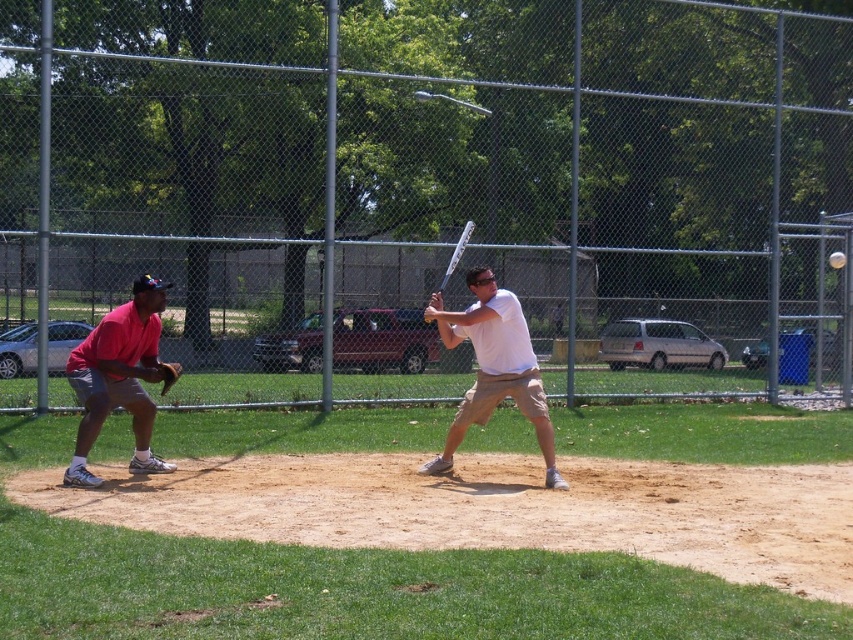
Question: Which is farther from the silver metallic bat at center?

Choices:
 (A) matte pink shirt at left
 (B) brown leather glove at left
 (C) white matte baseball bat at center
 (D) white matte baseball at center

Answer: (D)

Question: Is white matte baseball bat at center to the right of white matte baseball at center from the viewer's perspective?

Choices:
 (A) yes
 (B) no

Answer: (B)

Question: From the image, what is the correct spatial relationship of brown leather glove at left in relation to white matte baseball at center?

Choices:
 (A) below
 (B) above

Answer: (A)

Question: Is silver metallic bat at center smaller than brown leather glove at left?

Choices:
 (A) no
 (B) yes

Answer: (A)

Question: Considering the real-world distances, which object is closest to the silver metallic bat at center?

Choices:
 (A) white matte baseball at center
 (B) matte pink shirt at left
 (C) brown leather glove at left
 (D) white matte baseball bat at center

Answer: (D)

Question: Which point is closer to the camera taking this photo?

Choices:
 (A) (494, 340)
 (B) (173, 371)
 (C) (123, 396)
 (D) (836, 253)

Answer: (C)